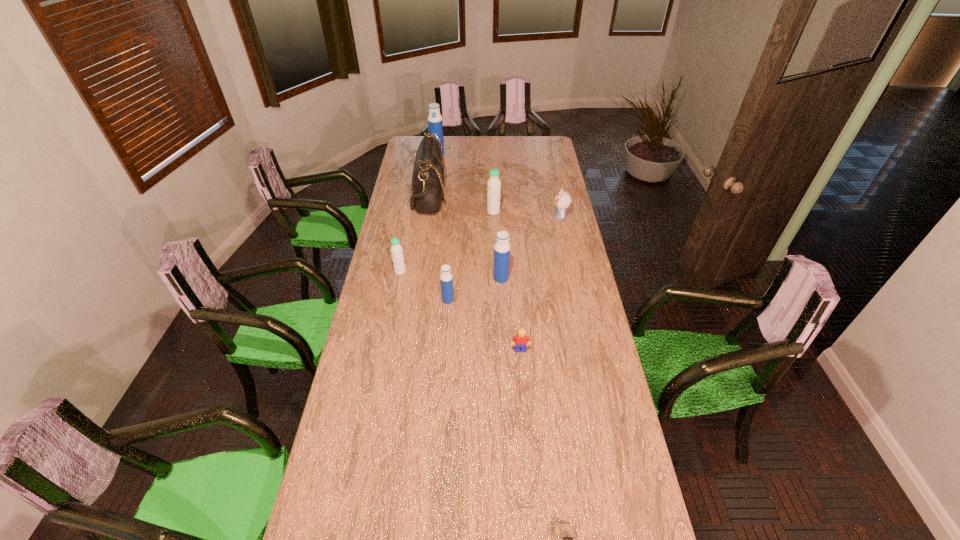
Identify which water bottle is the fifth nearest to the seventh tallest object. Please provide its 2D coordinates. Your answer should be formatted as a tuple, i.e. [(x, y)], where the tuple contains the x and y coordinates of a point satisfying the conditions above.

[(435, 125)]

The image size is (960, 540). In order to click on water bottle that is the third nearest to the kitten in this screenshot , I will do `click(446, 278)`.

Point out which blue water bottle is positioned as the nearest to the second farthest water bottle. Please provide its 2D coordinates. Your answer should be formatted as a tuple, i.e. [(x, y)], where the tuple contains the x and y coordinates of a point satisfying the conditions above.

[(501, 263)]

You are a GUI agent. You are given a task and a screenshot of the screen. Output one action in this format:
    pyautogui.click(x=<x>, y=<y>)
    Task: Click on the blue water bottle that stands as the closest to the third shortest object
    The height and width of the screenshot is (540, 960).
    Given the screenshot: What is the action you would take?
    pyautogui.click(x=501, y=263)